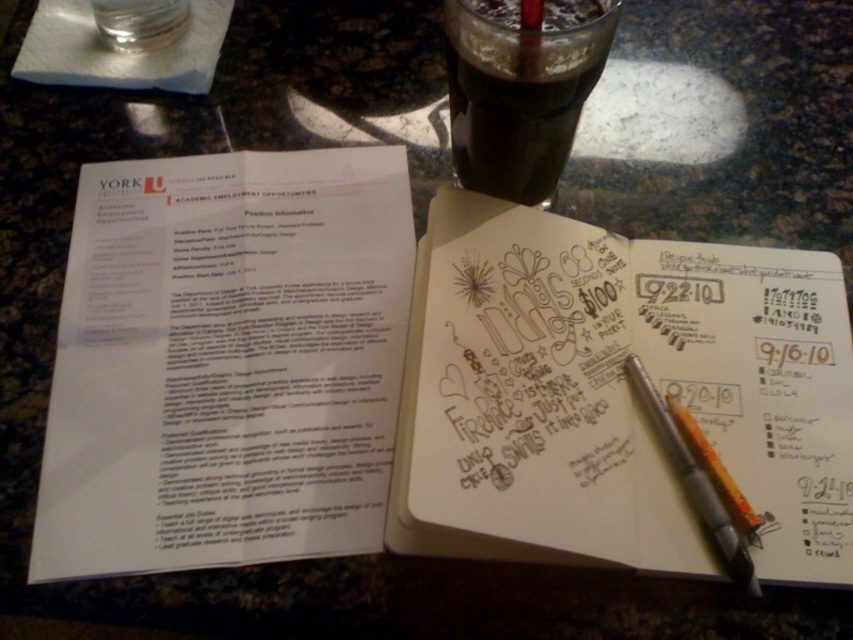
Between white paper at upper left and dark brown liquid at upper center, which one has more height?

white paper at upper left

Looking at this image, can you confirm if white paper at upper left is thinner than dark brown liquid at upper center?

No.

Between point (268, 266) and point (490, 168), which one is positioned behind?

The point (490, 168) is behind.

Where is `white paper at upper left`? The image size is (853, 640). white paper at upper left is located at coordinates (225, 362).

Is brown paper notebook at center to the right of silver metallic pen at center from the viewer's perspective?

Incorrect, brown paper notebook at center is not on the right side of silver metallic pen at center.

Can you confirm if brown paper notebook at center is thinner than silver metallic pen at center?

Incorrect, brown paper notebook at center's width is not less than silver metallic pen at center's.

This screenshot has height=640, width=853. What do you see at coordinates (618, 394) in the screenshot? I see `brown paper notebook at center` at bounding box center [618, 394].

The height and width of the screenshot is (640, 853). Find the location of `brown paper notebook at center`. brown paper notebook at center is located at coordinates (618, 394).

Can you confirm if dark brown liquid at upper center is positioned to the left of silver metallic pen at center?

Yes, dark brown liquid at upper center is to the left of silver metallic pen at center.

The height and width of the screenshot is (640, 853). I want to click on dark brown liquid at upper center, so click(x=518, y=97).